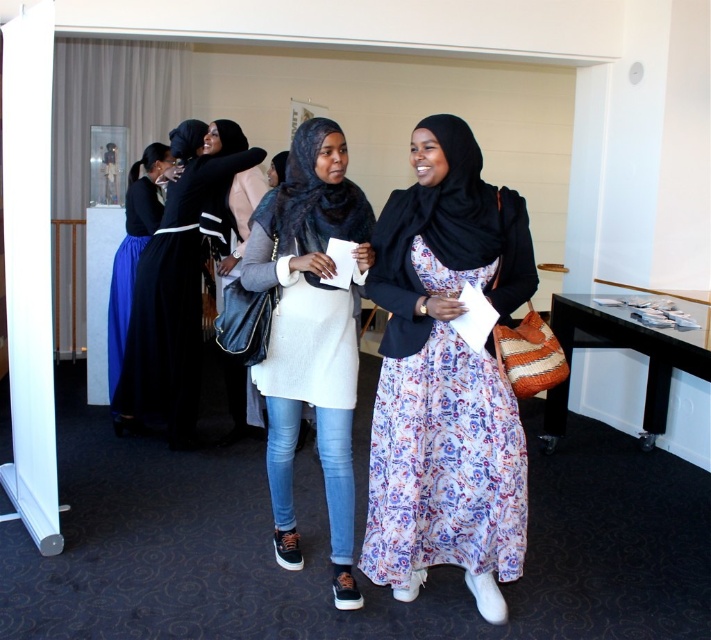
Question: Is white knit sweater at center smaller than matte black dress at left?

Choices:
 (A) yes
 (B) no

Answer: (A)

Question: Is floral silk dress at center to the right of matte black dress at left from the viewer's perspective?

Choices:
 (A) yes
 (B) no

Answer: (A)

Question: Is white knit sweater at center positioned behind matte black hijab at center?

Choices:
 (A) no
 (B) yes

Answer: (A)

Question: Which object is the farthest from the white textured dress at center?

Choices:
 (A) matte black dress at left
 (B) matte black hijab at center

Answer: (A)

Question: Which object is closer to the camera taking this photo?

Choices:
 (A) matte black hijab at center
 (B) white textured dress at center

Answer: (B)

Question: Which object is farther from the camera taking this photo?

Choices:
 (A) matte black dress at left
 (B) floral silk dress at center
 (C) white knit sweater at center
 (D) matte black hijab at center

Answer: (A)